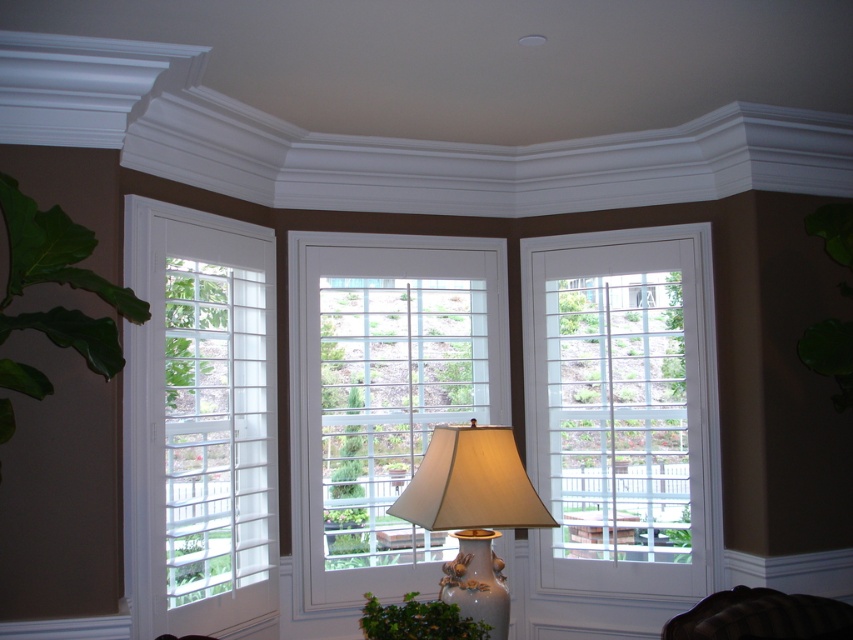
Question: Is white matte window at center to the right of porcelain lampshade at center from the viewer's perspective?

Choices:
 (A) no
 (B) yes

Answer: (B)

Question: Which object is positioned farthest from the green leafy plant at left?

Choices:
 (A) porcelain lampshade at center
 (B) white wood window at center
 (C) velvet dark brown armchair at lower right
 (D) white matte window at center

Answer: (D)

Question: Is green leafy plant at left wider than green leafy plant at lower center?

Choices:
 (A) yes
 (B) no

Answer: (A)

Question: Which point is closer to the camera?

Choices:
 (A) (259, 368)
 (B) (767, 620)

Answer: (B)

Question: Does white wood window at center have a smaller size compared to velvet dark brown armchair at lower right?

Choices:
 (A) yes
 (B) no

Answer: (B)

Question: Based on their relative distances, which object is farther from the velvet dark brown armchair at lower right?

Choices:
 (A) green leafy plant at lower center
 (B) white wood window at center

Answer: (B)